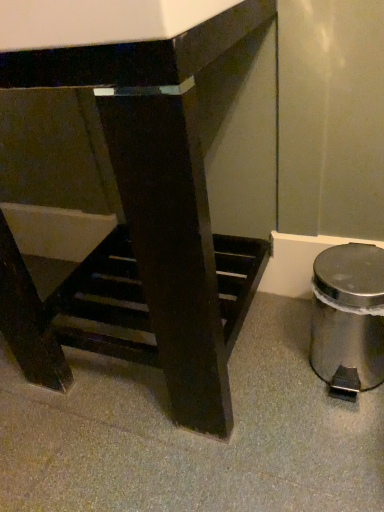
Question: Based on their positions, is polished stainless steel trash can at lower right located to the left or right of matte black table at center?

Choices:
 (A) right
 (B) left

Answer: (A)

Question: Is polished stainless steel trash can at lower right wider or thinner than matte black table at center?

Choices:
 (A) wide
 (B) thin

Answer: (B)

Question: From the image's perspective, is polished stainless steel trash can at lower right above or below matte black table at center?

Choices:
 (A) above
 (B) below

Answer: (B)

Question: Is matte black table at center wider or thinner than polished stainless steel trash can at lower right?

Choices:
 (A) thin
 (B) wide

Answer: (B)

Question: Choose the correct answer: Is matte black table at center inside polished stainless steel trash can at lower right or outside it?

Choices:
 (A) inside
 (B) outside

Answer: (B)

Question: From the image's perspective, relative to polished stainless steel trash can at lower right, is matte black table at center above or below?

Choices:
 (A) above
 (B) below

Answer: (A)

Question: Does point (158, 81) appear closer or farther from the camera than point (322, 310)?

Choices:
 (A) farther
 (B) closer

Answer: (B)